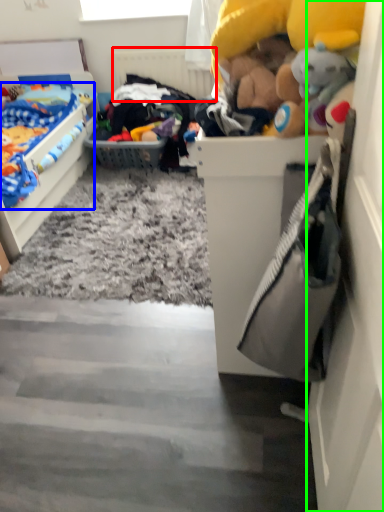
Question: Estimate the real-world distances between objects in this image. Which object is farther from radiator (highlighted by a red box), toy (highlighted by a blue box) or door (highlighted by a green box)?

Choices:
 (A) toy
 (B) door

Answer: (B)